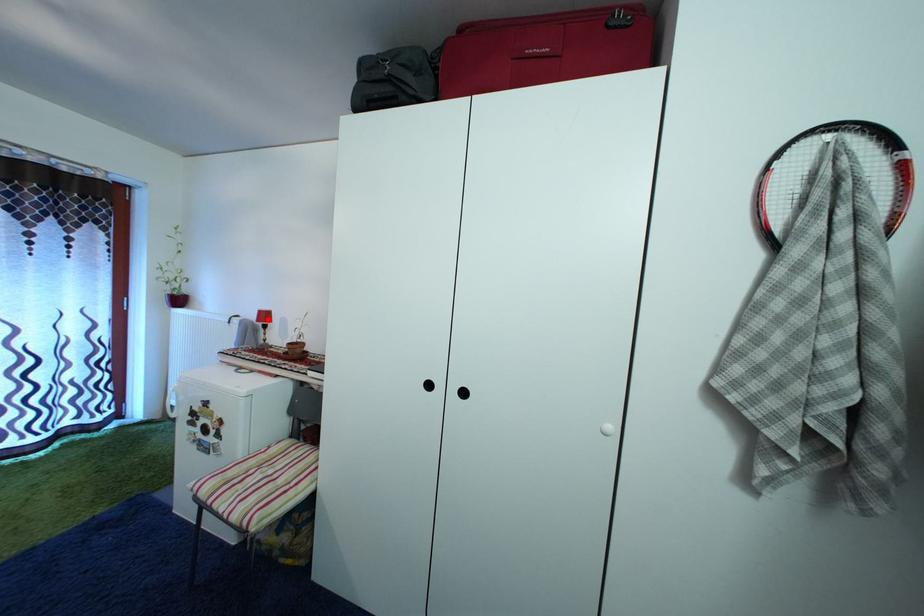
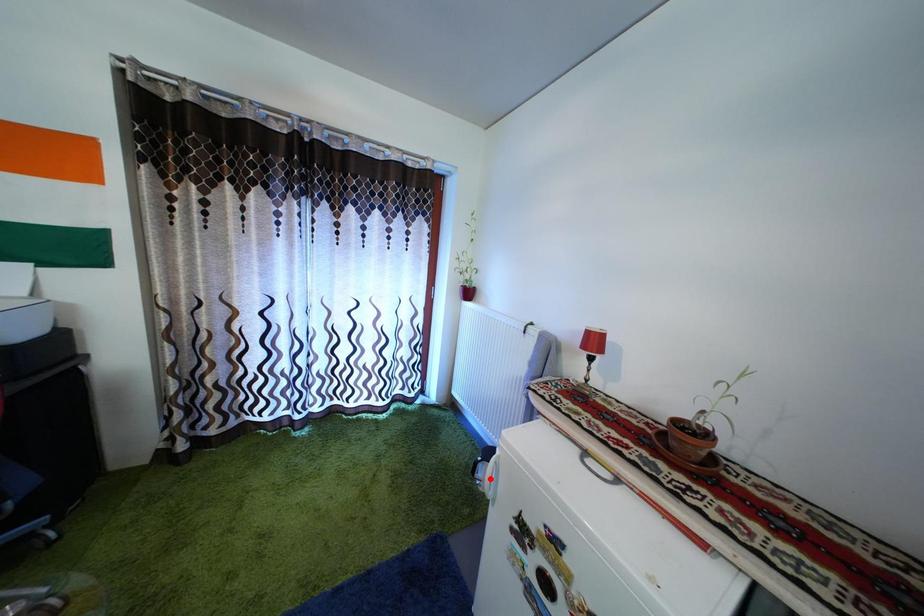
I am providing you with two images of the same scene from different viewpoints. A red point is marked on the first image and another point is marked on the second image. Are the points marked in image1 and image2 representing the same 3D position?

No